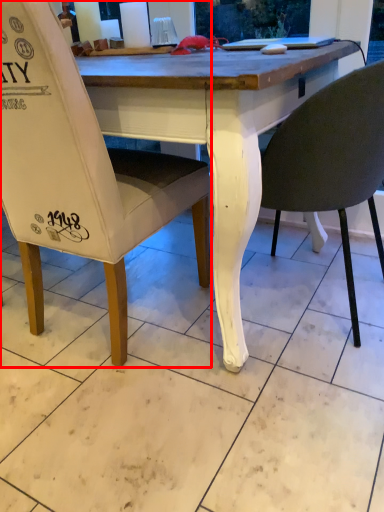
Question: Observing the image, what is the correct spatial positioning of chair (annotated by the red box) in reference to chair?

Choices:
 (A) left
 (B) right

Answer: (A)